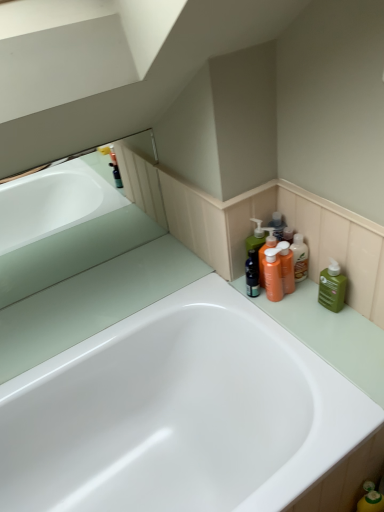
Question: Is orange matte pump bottle at upper right, which is counted as the 1th cleaning product, starting from the left, at the back of green matte bottle at right, acting as the 1th cleaning product starting from the right?

Choices:
 (A) no
 (B) yes

Answer: (A)

Question: From the image's perspective, does green matte bottle at right, marked as the second cleaning product in a left-to-right arrangement, appear higher than orange matte pump bottle at upper right, the second cleaning product positioned from the right?

Choices:
 (A) yes
 (B) no

Answer: (B)

Question: Is green matte bottle at right, marked as the second cleaning product in a left-to-right arrangement, with orange matte pump bottle at upper right, which is counted as the 1th cleaning product, starting from the left?

Choices:
 (A) yes
 (B) no

Answer: (B)

Question: From a real-world perspective, is green matte bottle at right, marked as the second cleaning product in a left-to-right arrangement, physically above orange matte pump bottle at upper right, the second cleaning product positioned from the right?

Choices:
 (A) no
 (B) yes

Answer: (A)

Question: Does green matte bottle at right, acting as the 1th cleaning product starting from the right, come behind orange matte pump bottle at upper right, which is counted as the 1th cleaning product, starting from the left?

Choices:
 (A) no
 (B) yes

Answer: (A)

Question: Considering the positions of matte glass bathtub at upper left and green matte bottle at right, acting as the 1th cleaning product starting from the right, in the image, is matte glass bathtub at upper left bigger or smaller than green matte bottle at right, acting as the 1th cleaning product starting from the right,?

Choices:
 (A) big
 (B) small

Answer: (A)

Question: Is point (120, 245) closer or farther from the camera than point (329, 292)?

Choices:
 (A) closer
 (B) farther

Answer: (B)

Question: Is matte glass bathtub at upper left situated inside green matte bottle at right, marked as the second cleaning product in a left-to-right arrangement, or outside?

Choices:
 (A) inside
 (B) outside

Answer: (B)

Question: Is matte glass bathtub at upper left taller or shorter than green matte bottle at right, marked as the second cleaning product in a left-to-right arrangement?

Choices:
 (A) short
 (B) tall

Answer: (B)

Question: From their relative heights in the image, would you say matte glass bathtub at upper left is taller or shorter than white glossy bathtub at center?

Choices:
 (A) short
 (B) tall

Answer: (A)

Question: From the image's perspective, relative to white glossy bathtub at center, is matte glass bathtub at upper left above or below?

Choices:
 (A) below
 (B) above

Answer: (B)

Question: Looking at their shapes, would you say matte glass bathtub at upper left is wider or thinner than white glossy bathtub at center?

Choices:
 (A) wide
 (B) thin

Answer: (B)

Question: In the image, is matte glass bathtub at upper left positioned in front of or behind white glossy bathtub at center?

Choices:
 (A) front
 (B) behind

Answer: (B)

Question: Considering their positions, is white glossy bathtub at center located in front of or behind matte glass bathtub at upper left?

Choices:
 (A) behind
 (B) front

Answer: (B)

Question: Is white glossy bathtub at center wider or thinner than matte glass bathtub at upper left?

Choices:
 (A) wide
 (B) thin

Answer: (A)